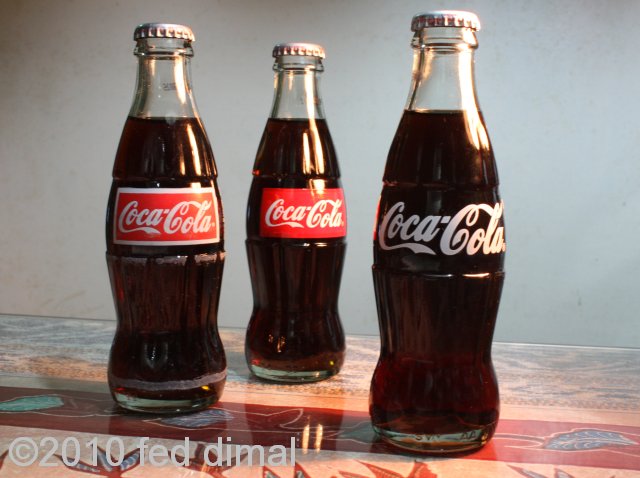
The image size is (640, 478). Identify the location of glass bottles. (162, 124), (301, 132), (454, 154), (460, 329), (300, 297), (162, 342).